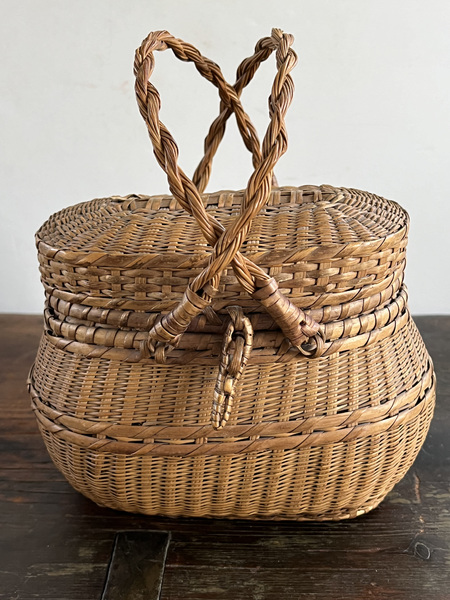
The height and width of the screenshot is (600, 450). I want to click on sides of basket lid, so click(407, 216), click(37, 233).